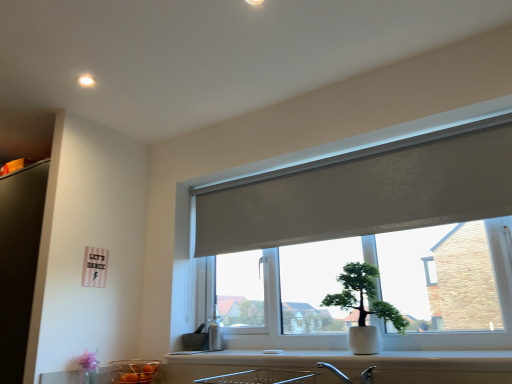
Question: Considering the positions of white ceramic pot at center and matte gray roller blind at center in the image, is white ceramic pot at center taller or shorter than matte gray roller blind at center?

Choices:
 (A) tall
 (B) short

Answer: (B)

Question: Would you say white ceramic pot at center is inside or outside matte gray roller blind at center?

Choices:
 (A) outside
 (B) inside

Answer: (A)

Question: Estimate the real-world distances between objects in this image. Which object is farther from the translucent glass bowl at lower left?

Choices:
 (A) white ceramic pot at center
 (B) white glossy counter top at lower center
 (C) matte gray roller blind at center

Answer: (C)

Question: Which of these objects is positioned closest to the translucent glass bowl at lower left?

Choices:
 (A) matte gray roller blind at center
 (B) white glossy counter top at lower center
 (C) white ceramic pot at center

Answer: (B)